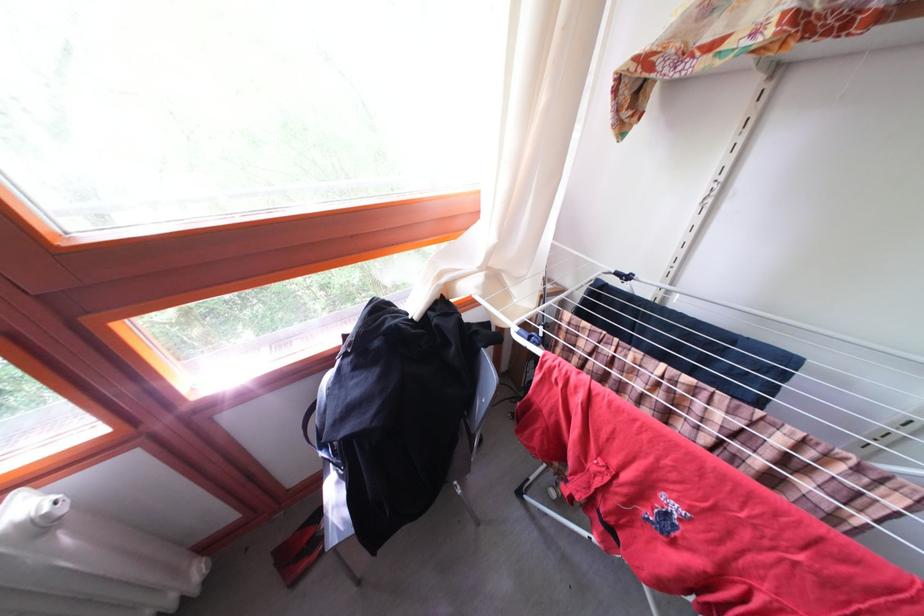
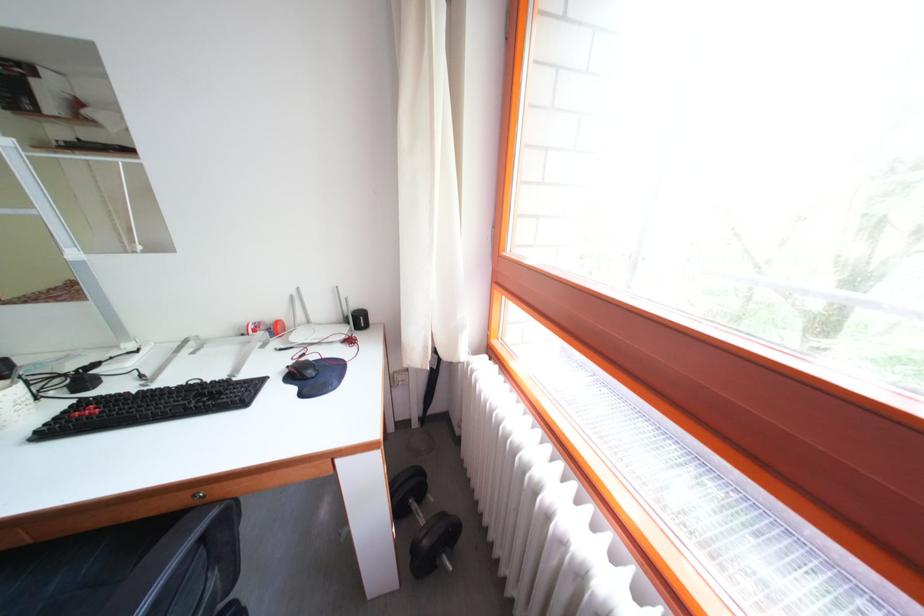
Based on the continuous images, in which direction is the camera rotating?

The camera's rotation is toward left-down.